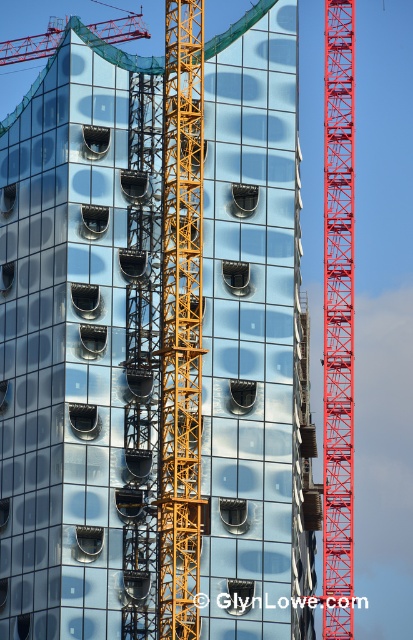
Who is higher up, yellow metallic crane at center or red metal crane at upper left?

red metal crane at upper left is higher up.

Does yellow metallic crane at center have a lesser width compared to red metal crane at upper left?

Indeed, yellow metallic crane at center has a lesser width compared to red metal crane at upper left.

Who is more distant from viewer, (x=171, y=280) or (x=106, y=29)?

The point (x=106, y=29) is behind.

Find the location of `yellow metallic crane at center`. yellow metallic crane at center is located at coordinates (180, 324).

Is yellow metallic crane at center above metallic red crane at right?

Correct, yellow metallic crane at center is located above metallic red crane at right.

Can you confirm if yellow metallic crane at center is shorter than metallic red crane at right?

Yes.

Who is more forward, (192, 186) or (351, 147)?

Positioned in front is point (192, 186).

At what (x,y) coordinates should I click in order to perform the action: click on yellow metallic crane at center. Please return your answer as a coordinate pair (x, y). Image resolution: width=413 pixels, height=640 pixels. Looking at the image, I should click on (180, 324).

Does metallic red crane at right appear over red metal crane at upper left?

Actually, metallic red crane at right is below red metal crane at upper left.

Does metallic red crane at right have a greater height compared to red metal crane at upper left?

Indeed, metallic red crane at right has a greater height compared to red metal crane at upper left.

This screenshot has height=640, width=413. What do you see at coordinates (339, 321) in the screenshot?
I see `metallic red crane at right` at bounding box center [339, 321].

You are a GUI agent. You are given a task and a screenshot of the screen. Output one action in this format:
    pyautogui.click(x=<x>, y=<y>)
    Task: Click on the metallic red crane at right
    
    Given the screenshot: What is the action you would take?
    pyautogui.click(x=339, y=321)